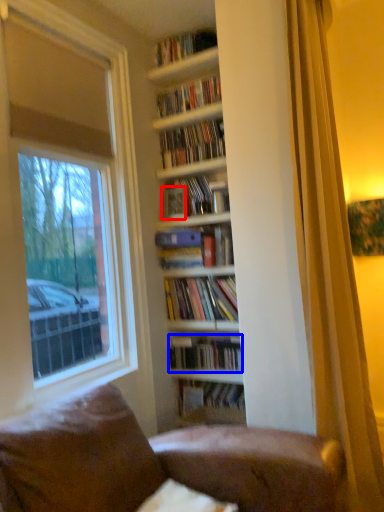
Question: Which point is closer to the camera, paperback book (highlighted by a red box) or book (highlighted by a blue box)?

Choices:
 (A) paperback book
 (B) book

Answer: (B)